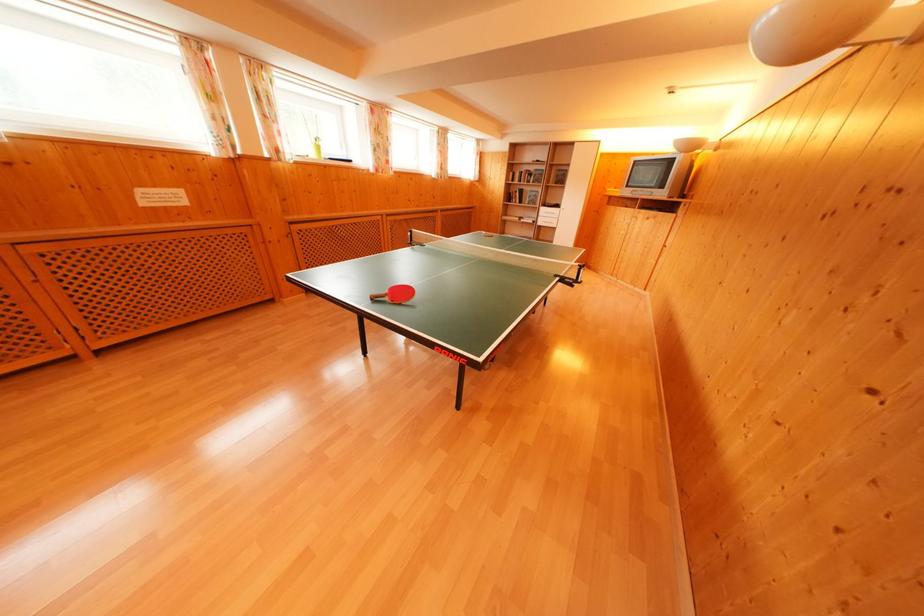
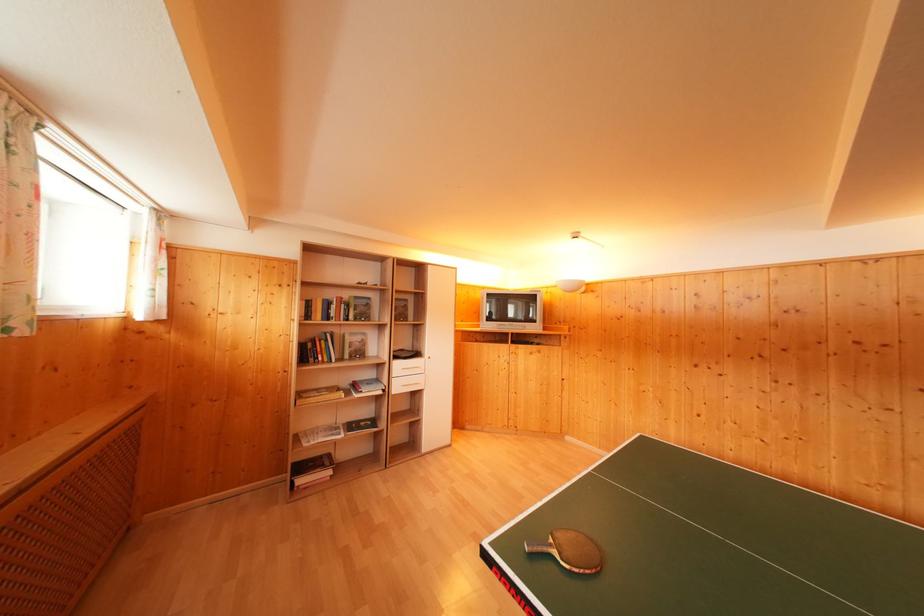
Find the pixel in the second image that matches point 545,219 in the first image.

(398, 379)